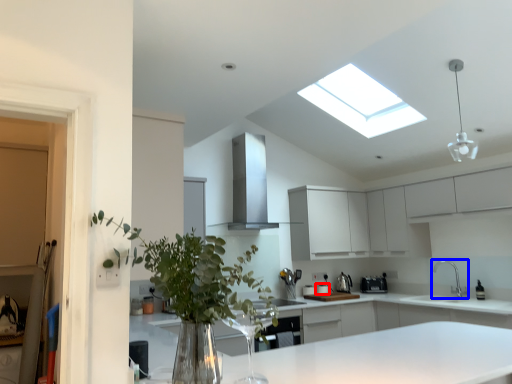
Question: Which object appears farthest to the camera in this image, appliance (highlighted by a red box) or tap (highlighted by a blue box)?

Choices:
 (A) appliance
 (B) tap

Answer: (A)